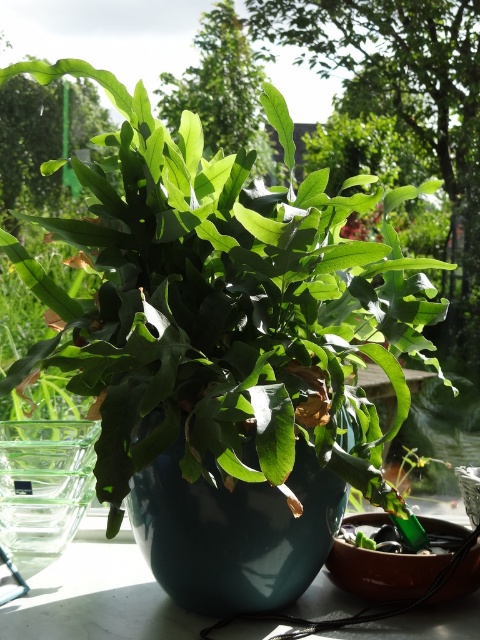
You are arranging flowers in the transparent glass vase at left and need to place it on the white marble table at center. Can you determine if the vase will fit on the table?

The white marble table at center might be wider than transparent glass vase at left, so there is a possibility that the vase will fit, but it is uncertain without exact measurements.

You are a plant enthusiast who wants to place a new decorative item next to the matte green leafy plant at center and the transparent glass vase at left. Considering their widths, which one requires more space horizontally?

The matte green leafy plant at center requires more horizontal space because its width surpasses that of the transparent glass vase at left.

You are a gardener who wants to water the transparent glass vase at left. However, there is a matte green leafy plant at center in the way. Can you reach the vase without moving the plant?

The matte green leafy plant at center is in front of the transparent glass vase at left, so you cannot reach the vase without moving the plant.